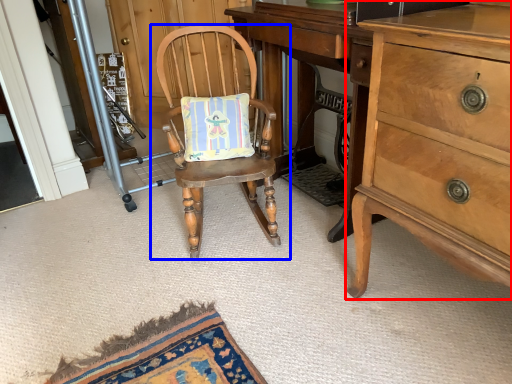
Question: Which point is further to the camera, cabinetry (highlighted by a red box) or chair (highlighted by a blue box)?

Choices:
 (A) cabinetry
 (B) chair

Answer: (B)